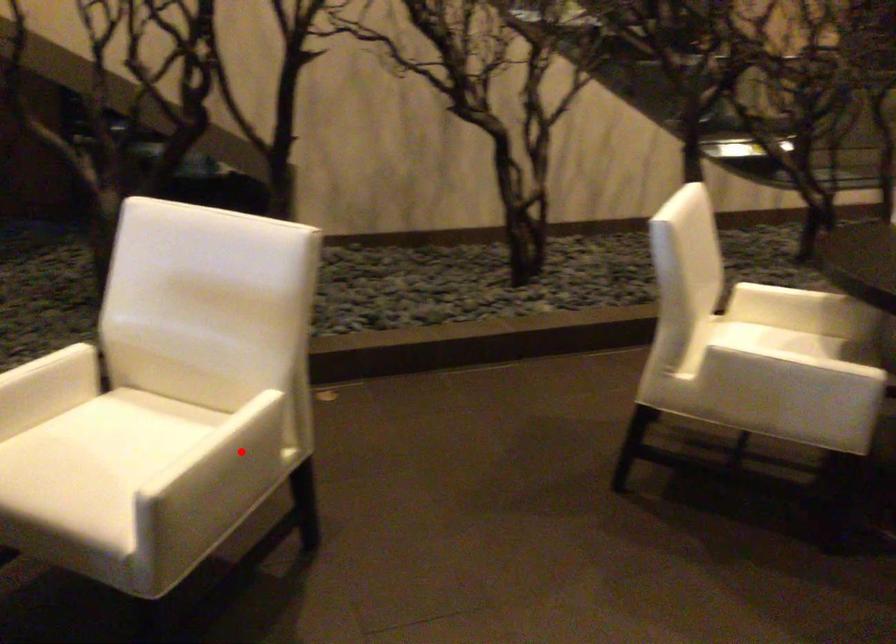
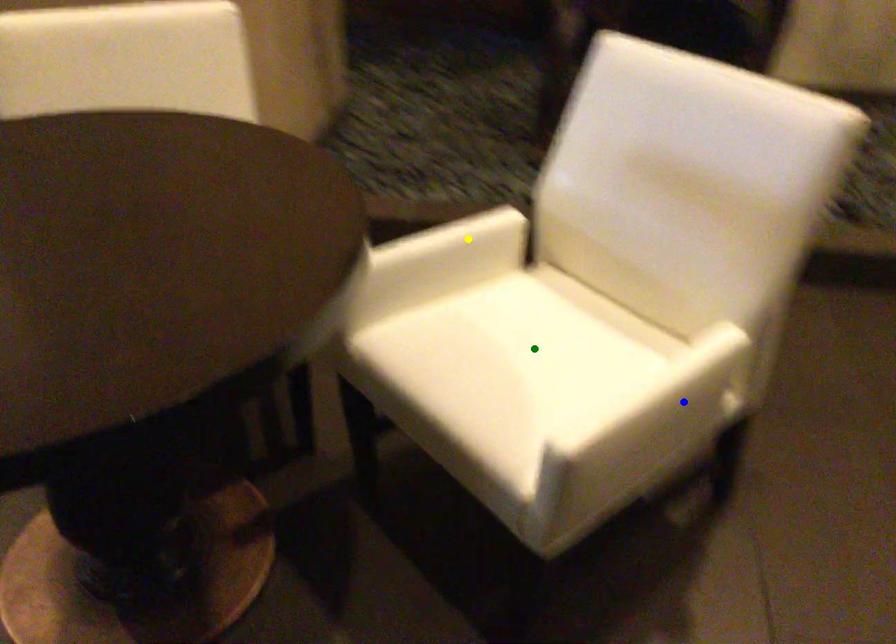
Question: I am providing you with two images of the same scene from different viewpoints. A red point is marked on the first image. You are given multiple points on the second image. Which mark in image 2 goes with the point in image 1?

Choices:
 (A) blue point
 (B) green point
 (C) yellow point

Answer: (A)